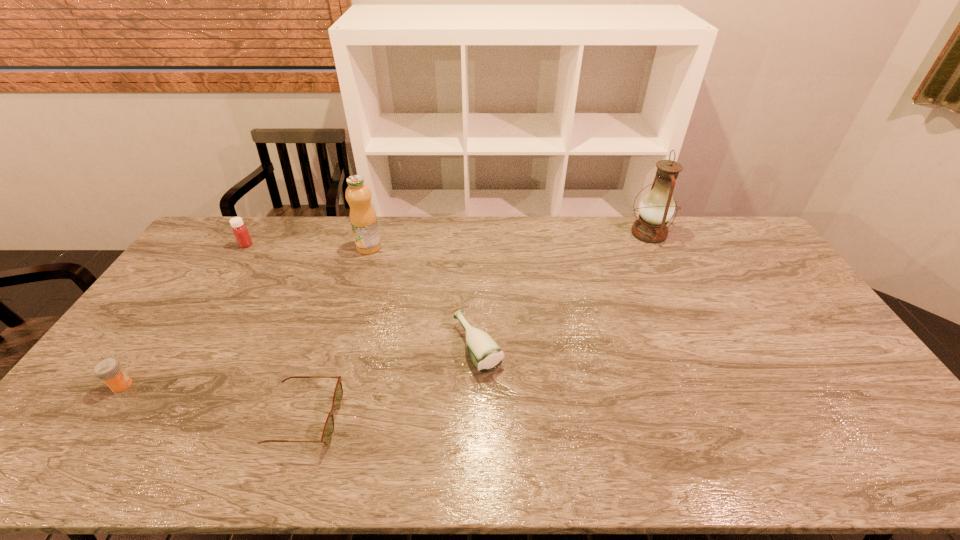
Locate an element on the screen. The image size is (960, 540). vacant position located 0.050m on the front label of the fruit juice is located at coordinates (364, 264).

Locate an element on the screen. This screenshot has width=960, height=540. vacant point located on the front of the third tallest object is located at coordinates (204, 311).

Locate an element on the screen. vacant region located on the left of the bottle is located at coordinates (418, 346).

Where is `vacant space located 0.350m on the label side of the shorter medicine`? The width and height of the screenshot is (960, 540). vacant space located 0.350m on the label side of the shorter medicine is located at coordinates (264, 384).

Locate an element on the screen. The height and width of the screenshot is (540, 960). free spot located at the front view of the shortest object is located at coordinates (394, 420).

You are a GUI agent. You are given a task and a screenshot of the screen. Output one action in this format:
    pyautogui.click(x=<x>, y=<y>)
    Task: Click on the oil lamp that is at the far edge
    Image resolution: width=960 pixels, height=540 pixels.
    Given the screenshot: What is the action you would take?
    pyautogui.click(x=656, y=208)

Find the location of `fruit juice situated at the far edge`. fruit juice situated at the far edge is located at coordinates (363, 220).

Where is `medicine situated at the far edge`? medicine situated at the far edge is located at coordinates (240, 231).

Locate an element on the screen. Image resolution: width=960 pixels, height=540 pixels. object situated at the near edge is located at coordinates (328, 430).

Where is `object located at the far left corner`? object located at the far left corner is located at coordinates pyautogui.click(x=240, y=231).